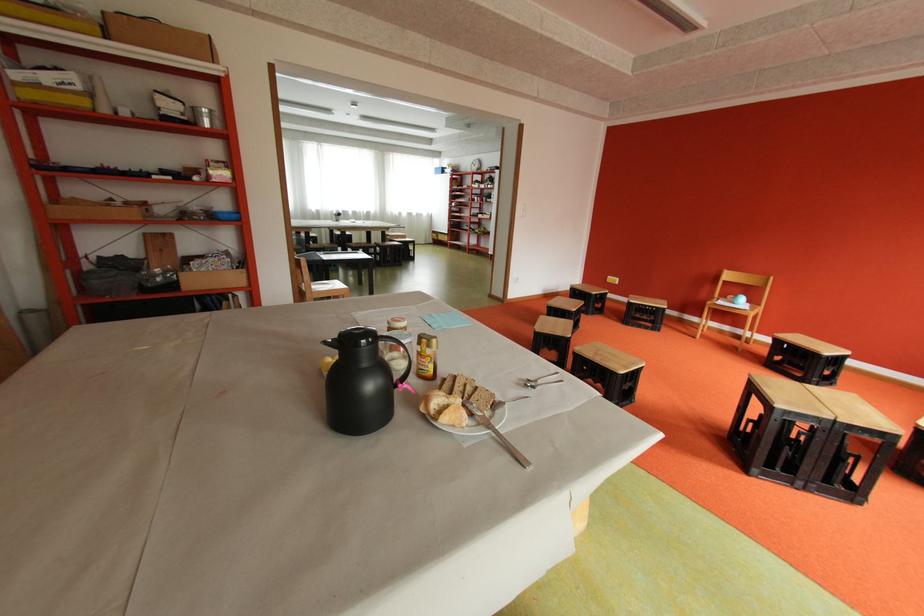
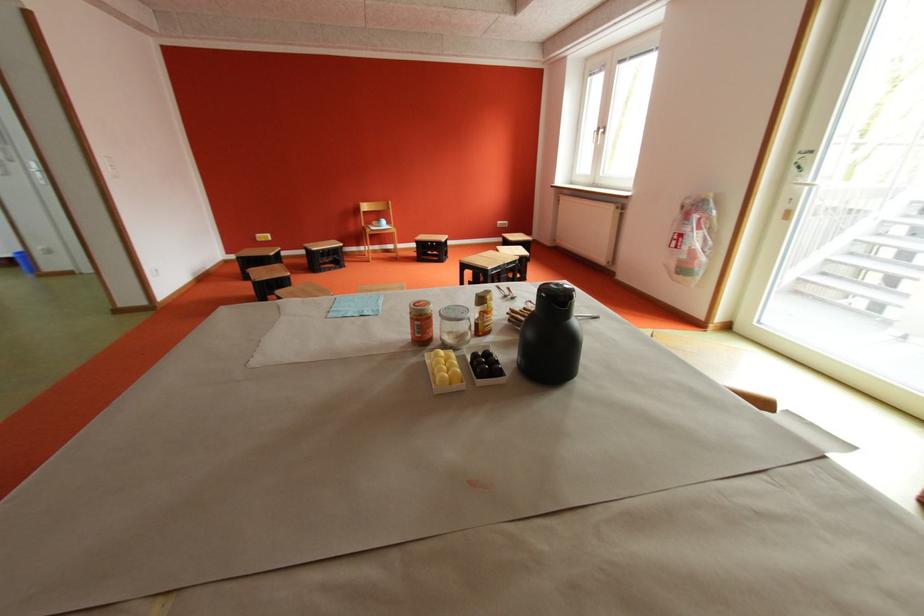
The point at (585, 294) is marked in the first image. Where is the corresponding point in the second image?

(257, 262)